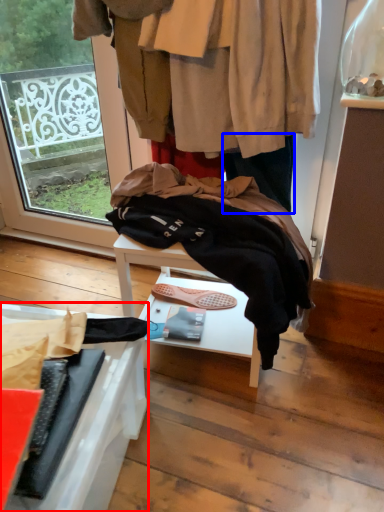
Question: Among these objects, which one is nearest to the camera, furniture (highlighted by a red box) or trousers (highlighted by a blue box)?

Choices:
 (A) furniture
 (B) trousers

Answer: (A)